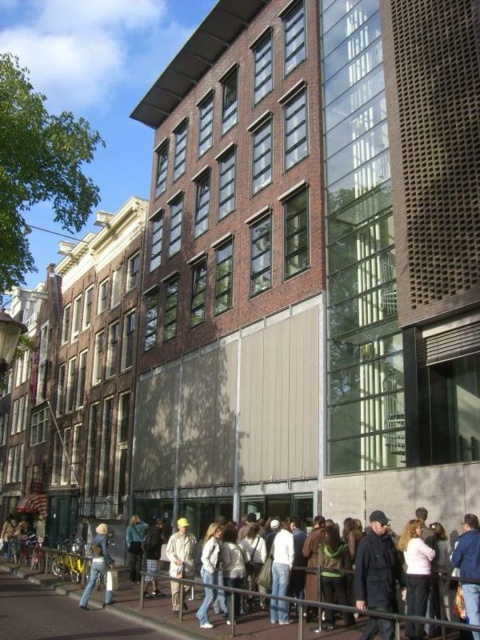
Between white cotton jacket at lower center and light brown leather jacket at lower left, which one has more height?

Standing taller between the two is white cotton jacket at lower center.

Is point (320, 602) closer to viewer compared to point (3, 541)?

That is True.

Is point (372, 612) positioned after point (11, 515)?

That is False.

Locate an element on the screen. Image resolution: width=480 pixels, height=640 pixels. white cotton jacket at lower center is located at coordinates (391, 616).

Is point (132, 518) closer to viewer compared to point (10, 516)?

Yes, point (132, 518) is in front of point (10, 516).

Between blue denim jeans at lower center and light brown leather jacket at lower left, which one appears on the left side from the viewer's perspective?

Positioned to the left is light brown leather jacket at lower left.

Is point (140, 531) closer to viewer compared to point (7, 532)?

Yes, point (140, 531) is in front of point (7, 532).

The image size is (480, 640). Identify the location of blue denim jeans at lower center. (134, 545).

Between khaki fabric pants at center and white cotton jacket at lower center, which one appears on the right side from the viewer's perspective?

white cotton jacket at lower center is more to the right.

Is khaki fabric pants at center positioned in front of white cotton jacket at lower center?

No, it is not.

Which is behind, point (179, 552) or point (457, 627)?

Point (179, 552)

Find the location of a particular element. khaki fabric pants at center is located at coordinates (180, 550).